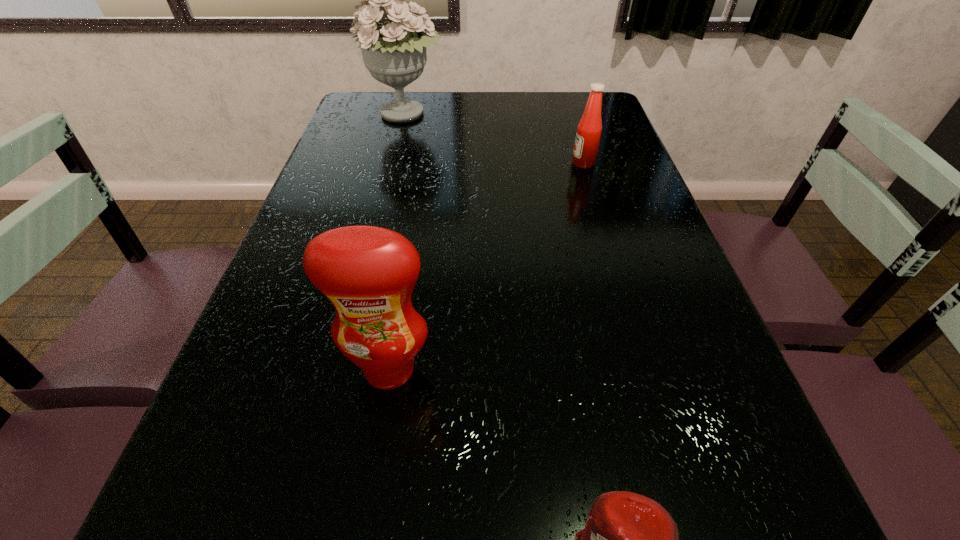
The image size is (960, 540). Identify the location of the farthest object. (395, 53).

Image resolution: width=960 pixels, height=540 pixels. What are the coordinates of `bouquet` in the screenshot? It's located at (395, 53).

You are a GUI agent. You are given a task and a screenshot of the screen. Output one action in this format:
    pyautogui.click(x=<x>, y=<y>)
    Task: Click on the tallest condiment
    
    Given the screenshot: What is the action you would take?
    pyautogui.click(x=368, y=273)

Where is `the second farthest condiment`? The width and height of the screenshot is (960, 540). the second farthest condiment is located at coordinates (368, 273).

Identify the location of the farthest condiment. The height and width of the screenshot is (540, 960). (587, 140).

Locate an element on the screen. The width and height of the screenshot is (960, 540). the second farthest object is located at coordinates (587, 140).

Locate an element on the screen. The image size is (960, 540). vacant space situated on the front of the farthest object is located at coordinates (393, 168).

Identify the location of free space located on the label side of the second tallest object. Image resolution: width=960 pixels, height=540 pixels. (381, 422).

Locate an element on the screen. vacant space located 0.200m on the front-facing side of the rightmost object is located at coordinates coord(500,163).

At what (x,y) coordinates should I click in order to perform the action: click on vacant position located on the front-facing side of the rightmost object. Please return your answer as a coordinate pair (x, y). Image resolution: width=960 pixels, height=540 pixels. Looking at the image, I should click on (471, 163).